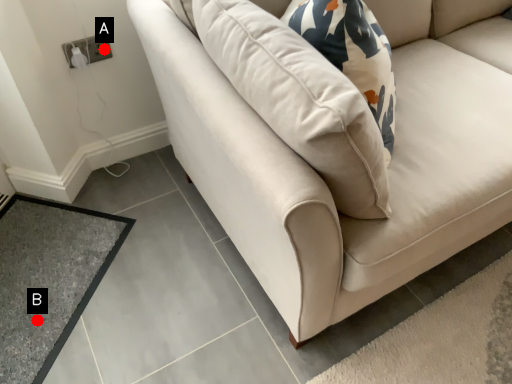
Question: Two points are circled on the image, labeled by A and B beside each circle. Which point is further to the camera?

Choices:
 (A) A is further
 (B) B is further

Answer: (A)